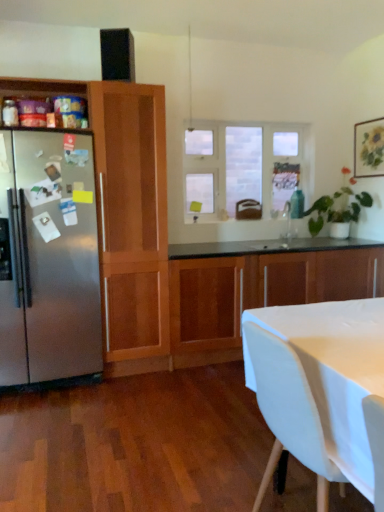
Find the location of a particular element. The width and height of the screenshot is (384, 512). satin stainless steel refrigerator at left is located at coordinates (49, 258).

Describe the element at coordinates (126, 216) in the screenshot. I see `wooden cabinet at left, which is counted as the first cabinetry, starting from the left` at that location.

The width and height of the screenshot is (384, 512). What do you see at coordinates (289, 412) in the screenshot? I see `white fabric chair at lower right` at bounding box center [289, 412].

Identify the location of satin stainless steel refrigerator at left. The width and height of the screenshot is (384, 512). (49, 258).

Is satin stainless steel refrigerator at left inside or outside of white fabric chair at lower right?

satin stainless steel refrigerator at left exists outside the volume of white fabric chair at lower right.

Considering the relative positions of satin stainless steel refrigerator at left and white fabric chair at lower right in the image provided, is satin stainless steel refrigerator at left in front of white fabric chair at lower right?

No.

From the image's perspective, relative to white fabric chair at lower right, is satin stainless steel refrigerator at left above or below?

Based on their image positions, satin stainless steel refrigerator at left is located above white fabric chair at lower right.

Looking at this image, from a real-world perspective, is clear glass window at center positioned over satin stainless steel refrigerator at left based on gravity?

Indeed, from a real-world perspective, clear glass window at center stands above satin stainless steel refrigerator at left.

Could you tell me if clear glass window at center is turned towards satin stainless steel refrigerator at left?

No, clear glass window at center is not facing towards satin stainless steel refrigerator at left.

Looking at their sizes, would you say clear glass window at center is wider or thinner than satin stainless steel refrigerator at left?

In the image, clear glass window at center appears to be more narrow than satin stainless steel refrigerator at left.

From the image's perspective, does clear glass window at center appear higher than satin stainless steel refrigerator at left?

Correct, clear glass window at center appears higher than satin stainless steel refrigerator at left in the image.

Which is farther, (282, 190) or (105, 334)?

Point (282, 190)

From a real-world perspective, who is located lower, clear glass window at center or wooden cabinet at left, which is counted as the first cabinetry, starting from the left?

wooden cabinet at left, which is counted as the first cabinetry, starting from the left, is physically lower.

Is clear glass window at center far away from wooden cabinet at left, marked as the second cabinetry in a right-to-left arrangement?

Yes, clear glass window at center and wooden cabinet at left, marked as the second cabinetry in a right-to-left arrangement, are quite far apart.

Which of these two, clear glass window at center or white fabric chair at lower right, is bigger?

white fabric chair at lower right is bigger.

From the picture: Would you consider clear glass window at center to be distant from white fabric chair at lower right?

Yes.

Is point (260, 143) positioned behind point (307, 442)?

Yes, it is.

At what (x,y) coordinates should I click in order to perform the action: click on chair that appears on the left of clear glass window at center. Please return your answer as a coordinate pair (x, y). This screenshot has height=512, width=384. Looking at the image, I should click on (289, 412).

Would you say white fabric chair at lower right is a long distance from clear glass window at center?

Absolutely, white fabric chair at lower right is distant from clear glass window at center.

Between white fabric chair at lower right and clear glass window at center, which one has larger width?

Wider between the two is white fabric chair at lower right.

From a real-world perspective, between white fabric chair at lower right and clear glass window at center, who is vertically lower?

In real-world perspective, white fabric chair at lower right is lower.

Who is shorter, white fabric chair at lower right or clear glass window at center?

white fabric chair at lower right.

Is wooden cabinet at center, the 1th cabinetry from the right, in front of or behind clear glass window at center in the image?

In the image, wooden cabinet at center, the 1th cabinetry from the right, appears in front of clear glass window at center.

How different are the orientations of wooden cabinet at center, the second cabinetry positioned from the left, and clear glass window at center in degrees?

The angular difference between wooden cabinet at center, the second cabinetry positioned from the left, and clear glass window at center is 0.29 degrees.

Who is bigger, wooden cabinet at center, the second cabinetry positioned from the left, or clear glass window at center?

wooden cabinet at center, the second cabinetry positioned from the left, is bigger.

Which is correct: wooden cabinet at center, the second cabinetry positioned from the left, is inside clear glass window at center, or outside of it?

wooden cabinet at center, the second cabinetry positioned from the left, exists outside the volume of clear glass window at center.

From a real-world perspective, does white fabric chair at lower right stand above satin stainless steel refrigerator at left?

Incorrect, from a real-world perspective, white fabric chair at lower right is lower than satin stainless steel refrigerator at left.

Between white fabric chair at lower right and satin stainless steel refrigerator at left, which one has larger size?

satin stainless steel refrigerator at left is bigger.

Is white fabric chair at lower right outside of satin stainless steel refrigerator at left?

Yes, white fabric chair at lower right is located beyond the bounds of satin stainless steel refrigerator at left.

Is white fabric chair at lower right looking in the opposite direction of satin stainless steel refrigerator at left?

No.

Image resolution: width=384 pixels, height=512 pixels. Identify the location of chair that appears in front of the satin stainless steel refrigerator at left. (289, 412).

At what (x,y) coordinates should I click in order to perform the action: click on refrigerator to the left of clear glass window at center. Please return your answer as a coordinate pair (x, y). The image size is (384, 512). Looking at the image, I should click on (49, 258).

From the image, which object appears to be farther from satin stainless steel refrigerator at left, clear glass window at center or wooden cabinet at center, the second cabinetry positioned from the left?

clear glass window at center is positioned further to the anchor satin stainless steel refrigerator at left.

When comparing their distances from white fabric chair at lower right, does clear glass window at center or satin stainless steel refrigerator at left seem further?

clear glass window at center.

Based on their spatial positions, is wooden cabinet at center, the second cabinetry positioned from the left, or wooden cabinet at left, which is counted as the first cabinetry, starting from the left, closer to clear glass window at center?

wooden cabinet at center, the second cabinetry positioned from the left, is positioned closer to the anchor clear glass window at center.

When comparing their distances from satin stainless steel refrigerator at left, does wooden cabinet at center, the 1th cabinetry from the right, or clear glass window at center seem further?

Among the two, clear glass window at center is located further to satin stainless steel refrigerator at left.

Based on their spatial positions, is wooden cabinet at left, which is counted as the first cabinetry, starting from the left, or white fabric chair at lower right closer to clear glass window at center?

wooden cabinet at left, which is counted as the first cabinetry, starting from the left.

Estimate the real-world distances between objects in this image. Which object is closer to wooden cabinet at left, marked as the second cabinetry in a right-to-left arrangement, satin stainless steel refrigerator at left or wooden cabinet at center, the second cabinetry positioned from the left?

Among the two, satin stainless steel refrigerator at left is located nearer to wooden cabinet at left, marked as the second cabinetry in a right-to-left arrangement.

When comparing their distances from wooden cabinet at left, marked as the second cabinetry in a right-to-left arrangement, does white fabric chair at lower right or clear glass window at center seem closer?

Among the two, clear glass window at center is located nearer to wooden cabinet at left, marked as the second cabinetry in a right-to-left arrangement.

Estimate the real-world distances between objects in this image. Which object is further from satin stainless steel refrigerator at left, white fabric chair at lower right or wooden cabinet at center, the second cabinetry positioned from the left?

white fabric chair at lower right lies further to satin stainless steel refrigerator at left than the other object.

Where is `refrigerator located between white fabric chair at lower right and clear glass window at center in the depth direction`? refrigerator located between white fabric chair at lower right and clear glass window at center in the depth direction is located at coordinates (49, 258).

Find the location of a particular element. refrigerator between white fabric chair at lower right and wooden cabinet at center, the second cabinetry positioned from the left, along the z-axis is located at coordinates (49, 258).

The height and width of the screenshot is (512, 384). In order to click on cabinetry between satin stainless steel refrigerator at left and white fabric chair at lower right from left to right in this screenshot , I will do `click(126, 216)`.

I want to click on cabinetry between satin stainless steel refrigerator at left and clear glass window at center from left to right, so click(126, 216).